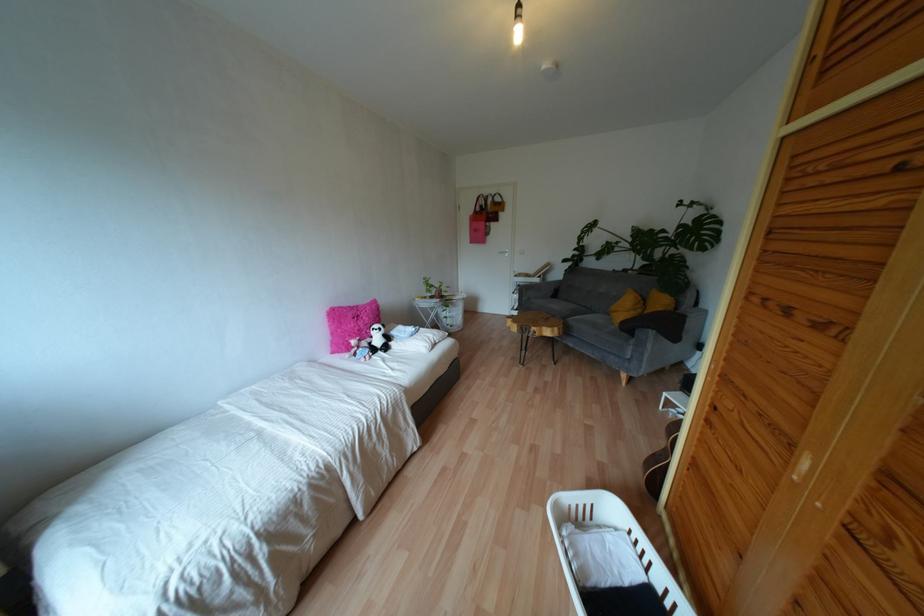
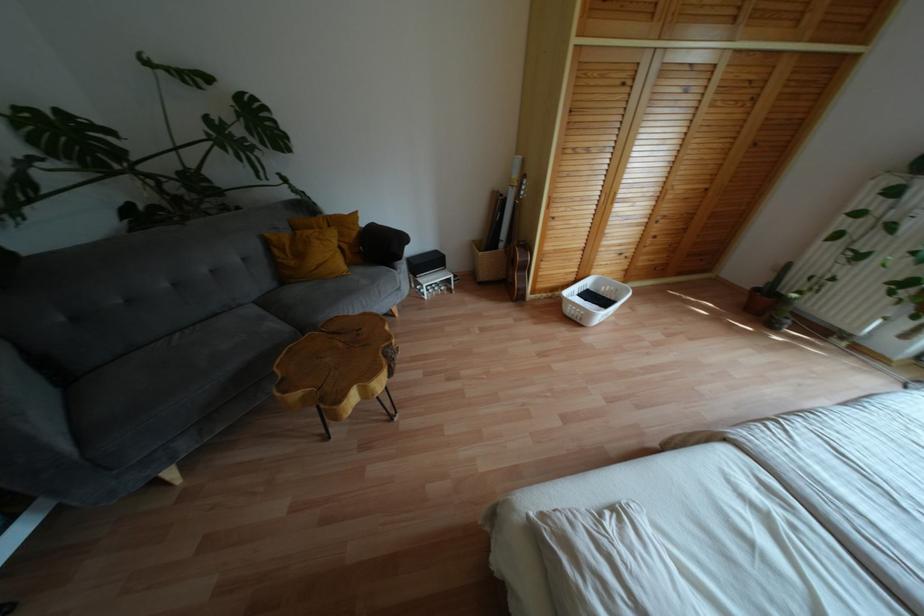
Find the pixel in the second image that matches pixel 712 216 in the first image.

(253, 98)